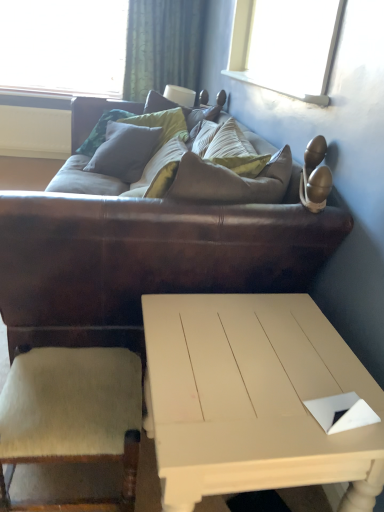
Question: Can you confirm if beige wool armchair at lower left is wider than white painted wood coffee table at lower center?

Choices:
 (A) yes
 (B) no

Answer: (B)

Question: From a real-world perspective, is beige wool armchair at lower left physically below white painted wood coffee table at lower center?

Choices:
 (A) no
 (B) yes

Answer: (B)

Question: Considering the relative sizes of beige wool armchair at lower left and white painted wood coffee table at lower center in the image provided, is beige wool armchair at lower left smaller than white painted wood coffee table at lower center?

Choices:
 (A) no
 (B) yes

Answer: (B)

Question: From the image's perspective, is beige wool armchair at lower left over white painted wood coffee table at lower center?

Choices:
 (A) no
 (B) yes

Answer: (A)

Question: From a real-world perspective, is beige wool armchair at lower left on top of white painted wood coffee table at lower center?

Choices:
 (A) no
 (B) yes

Answer: (A)

Question: Is matte gray pillow at center to the left or to the right of brown leather couch at center in the image?

Choices:
 (A) right
 (B) left

Answer: (B)

Question: Is point (119, 119) positioned closer to the camera than point (289, 278)?

Choices:
 (A) farther
 (B) closer

Answer: (A)

Question: Relative to brown leather couch at center, is matte gray pillow at center in front or behind?

Choices:
 (A) behind
 (B) front

Answer: (A)

Question: Is matte gray pillow at center taller or shorter than brown leather couch at center?

Choices:
 (A) short
 (B) tall

Answer: (A)

Question: Is green textured curtain at upper center taller or shorter than brown leather couch at center?

Choices:
 (A) short
 (B) tall

Answer: (A)

Question: Is green textured curtain at upper center bigger or smaller than brown leather couch at center?

Choices:
 (A) big
 (B) small

Answer: (B)

Question: Would you say green textured curtain at upper center is to the left or to the right of brown leather couch at center in the picture?

Choices:
 (A) right
 (B) left

Answer: (B)

Question: Is green textured curtain at upper center in front of or behind brown leather couch at center in the image?

Choices:
 (A) front
 (B) behind

Answer: (B)

Question: From their relative heights in the image, would you say brown leather couch at center is taller or shorter than matte gray pillow at center?

Choices:
 (A) tall
 (B) short

Answer: (A)

Question: From the image's perspective, is brown leather couch at center located above or below matte gray pillow at center?

Choices:
 (A) below
 (B) above

Answer: (A)